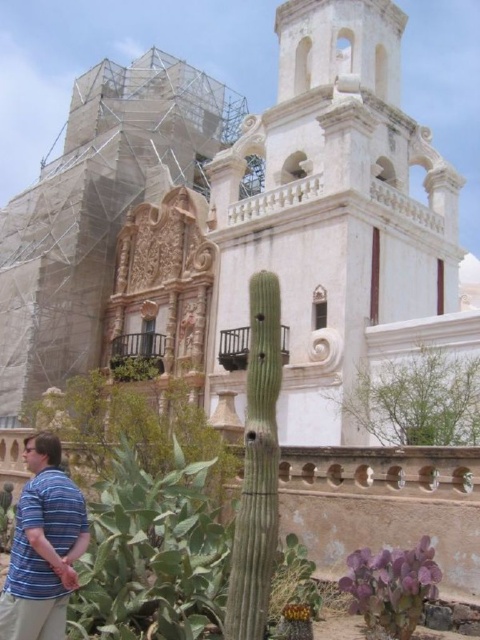
The width and height of the screenshot is (480, 640). What do you see at coordinates (43, 547) in the screenshot?
I see `blue striped shirt at lower left` at bounding box center [43, 547].

This screenshot has width=480, height=640. Describe the element at coordinates (43, 547) in the screenshot. I see `blue striped shirt at lower left` at that location.

Locate an element on the screen. blue striped shirt at lower left is located at coordinates (43, 547).

Between point (60, 586) and point (455, 435), which one is positioned in front?

Positioned in front is point (60, 586).

Is blue striped shirt at lower left in front of green leafy plant at upper center?

Yes.

Who is more distant from viewer, (x=29, y=456) or (x=412, y=396)?

The point (x=412, y=396) is behind.

This screenshot has height=640, width=480. I want to click on blue striped shirt at lower left, so click(43, 547).

Does point (12, 592) lie behind point (149, 353)?

No, it is not.

Locate an element on the screen. This screenshot has height=640, width=480. blue striped shirt at lower left is located at coordinates (43, 547).

Does point (40, 451) lie in front of point (154, 371)?

Yes, it is.

Where is `blue striped shirt at lower left`? This screenshot has height=640, width=480. blue striped shirt at lower left is located at coordinates (43, 547).